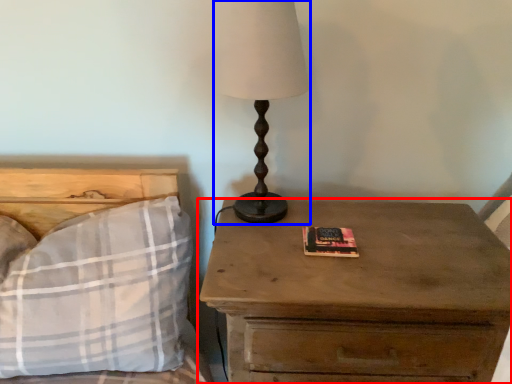
Question: Which point is further to the camera, nightstand (highlighted by a red box) or table lamp (highlighted by a blue box)?

Choices:
 (A) nightstand
 (B) table lamp

Answer: (B)